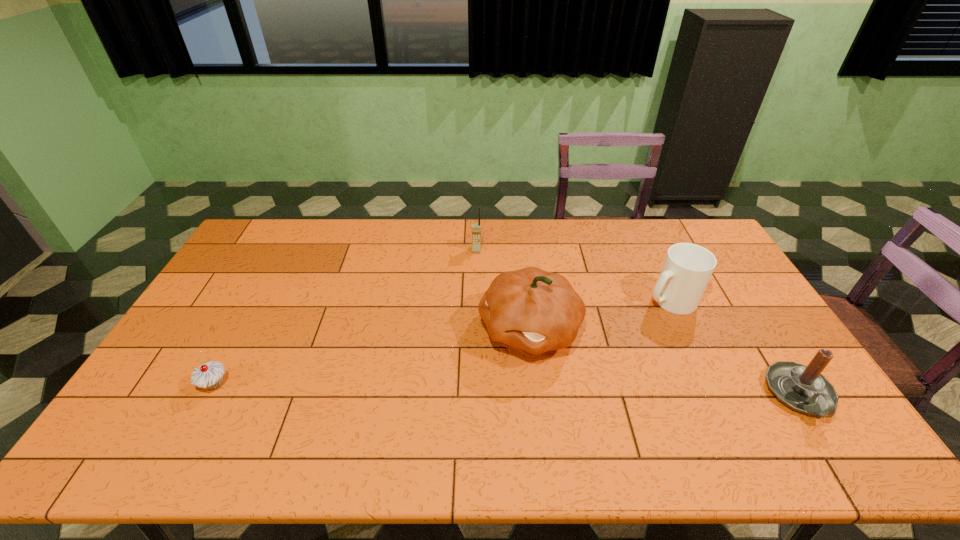
Identify the location of the closest object to the cellular telephone. (530, 310).

Select which object is the second closest to the pumpkin. Please provide its 2D coordinates. Your answer should be formatted as a tuple, i.e. [(x, y)], where the tuple contains the x and y coordinates of a point satisfying the conditions above.

[(687, 268)]

Identify the location of vacant position in the image that satisfies the following two spatial constraints: 1. on the front side of the farthest object; 2. on the right side of the tallest object. (476, 330).

Find the location of a particular element. The image size is (960, 540). blank area in the image that satisfies the following two spatial constraints: 1. on the back side of the tallest object; 2. on the left side of the cupcake is located at coordinates (244, 330).

The image size is (960, 540). I want to click on vacant area in the image that satisfies the following two spatial constraints: 1. on the back side of the shortest object; 2. on the right side of the fourth object from left to right, so click(x=260, y=299).